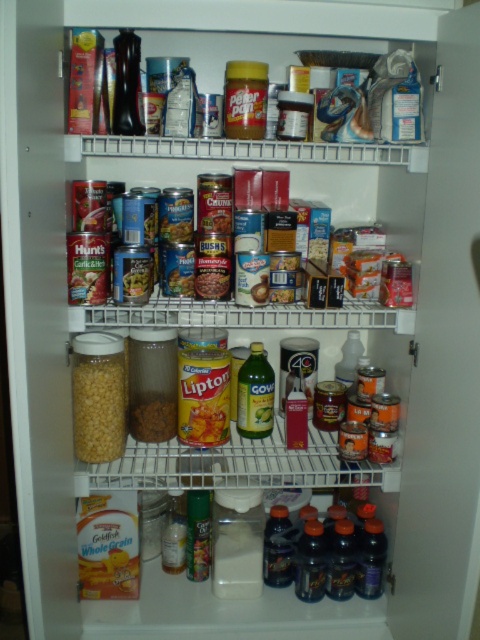
Is yellow matte corn at center wider than yellow matte lipton tea at center?

No.

Is yellow matte corn at center bigger than yellow matte lipton tea at center?

Indeed, yellow matte corn at center has a larger size compared to yellow matte lipton tea at center.

You are a GUI agent. You are given a task and a screenshot of the screen. Output one action in this format:
    pyautogui.click(x=<x>, y=<y>)
    Task: Click on the yellow matte corn at center
    This screenshot has height=640, width=480.
    Given the screenshot: What is the action you would take?
    pyautogui.click(x=97, y=406)

Is yellow matte lipton tea at center bigger than brown crunchy cereal at center?

Indeed, yellow matte lipton tea at center has a larger size compared to brown crunchy cereal at center.

Consider the image. Who is positioned more to the left, yellow matte lipton tea at center or brown crunchy cereal at center?

From the viewer's perspective, brown crunchy cereal at center appears more on the left side.

Is point (217, 444) more distant than point (165, 422)?

No, it is not.

The width and height of the screenshot is (480, 640). Find the location of `yellow matte lipton tea at center`. yellow matte lipton tea at center is located at coordinates (204, 420).

Does brown crunchy cereal at center appear on the right side of green matte can at center?

Correct, you'll find brown crunchy cereal at center to the right of green matte can at center.

From the picture: Is brown crunchy cereal at center smaller than green matte can at center?

No, brown crunchy cereal at center is not smaller than green matte can at center.

The width and height of the screenshot is (480, 640). Describe the element at coordinates (153, 419) in the screenshot. I see `brown crunchy cereal at center` at that location.

In order to click on brown crunchy cereal at center in this screenshot , I will do `click(153, 419)`.